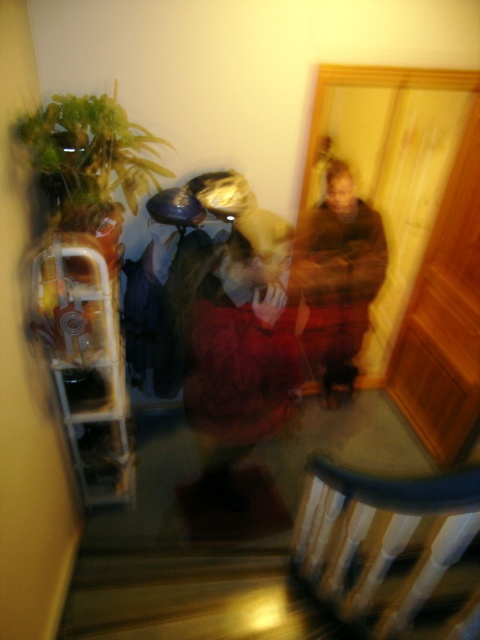
Image resolution: width=480 pixels, height=640 pixels. Describe the element at coordinates (389, 548) in the screenshot. I see `white painted wood balustrade at bottom` at that location.

Which is in front, point (331, 582) or point (372, 272)?

Point (331, 582)

At what (x,y) coordinates should I click in order to perform the action: click on white painted wood balustrade at bottom. Please return your answer as a coordinate pair (x, y). The image size is (480, 640). Looking at the image, I should click on (389, 548).

This screenshot has width=480, height=640. What do you see at coordinates (231, 358) in the screenshot?
I see `velvet red dress at center` at bounding box center [231, 358].

Does velvet red dress at center have a greater height compared to brown fuzzy sweater at center?

No.

Where is `velvet red dress at center`? The width and height of the screenshot is (480, 640). velvet red dress at center is located at coordinates (231, 358).

Which is in front, point (454, 632) or point (267, 301)?

Point (454, 632)

Who is more forward, (317, 477) or (291, 340)?

Point (317, 477) is in front.

Where is `white painted wood balustrade at bottom`? The width and height of the screenshot is (480, 640). white painted wood balustrade at bottom is located at coordinates (389, 548).